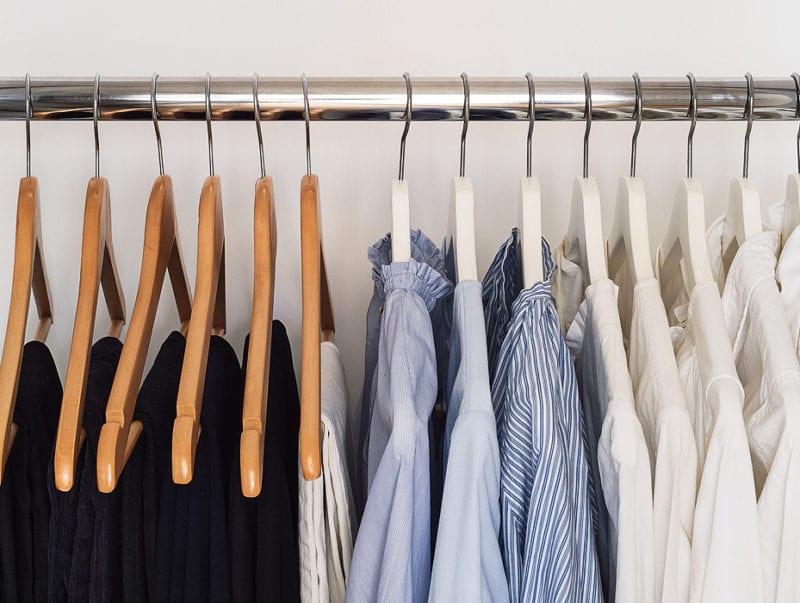
This screenshot has width=800, height=603. Identify the location of everything hanging on a hanger that isn't a white shirt. (546, 406), (470, 406), (402, 403), (334, 467), (278, 485), (213, 485), (145, 467), (100, 482), (37, 479).